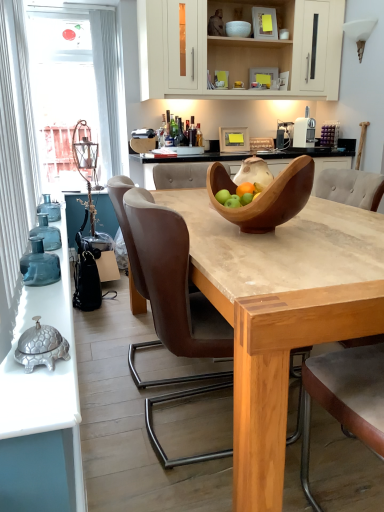
Question: Is light brown leather armchair at center at the right side of translucent glass bottles at left?

Choices:
 (A) yes
 (B) no

Answer: (A)

Question: Can you confirm if light brown leather armchair at center is taller than translucent glass bottles at left?

Choices:
 (A) yes
 (B) no

Answer: (A)

Question: Does light brown leather armchair at center lie behind translucent glass bottles at left?

Choices:
 (A) yes
 (B) no

Answer: (A)

Question: Is translucent glass bottles at left completely or partially inside light brown leather armchair at center?

Choices:
 (A) yes
 (B) no

Answer: (B)

Question: Is light brown leather armchair at center positioned with its back to translucent glass bottles at left?

Choices:
 (A) yes
 (B) no

Answer: (B)

Question: Considering the positions of brown leather chair at center and translucent glass bottles at left in the image, is brown leather chair at center taller or shorter than translucent glass bottles at left?

Choices:
 (A) short
 (B) tall

Answer: (B)

Question: Based on their positions, is brown leather chair at center located to the left or right of translucent glass bottles at left?

Choices:
 (A) right
 (B) left

Answer: (A)

Question: From the image's perspective, relative to translucent glass bottles at left, is brown leather chair at center above or below?

Choices:
 (A) above
 (B) below

Answer: (B)

Question: From a real-world perspective, is brown leather chair at center above or below translucent glass bottles at left?

Choices:
 (A) above
 (B) below

Answer: (B)

Question: Is point (46, 425) closer or farther from the camera than point (248, 28)?

Choices:
 (A) farther
 (B) closer

Answer: (B)

Question: In the image, is translucent glass bottles at left positioned in front of or behind white glossy bowl at upper center, which appears as the first bowl when viewed from the back?

Choices:
 (A) front
 (B) behind

Answer: (A)

Question: From the image's perspective, relative to white glossy bowl at upper center, the 2th bowl in the front-to-back sequence, is translucent glass bottles at left above or below?

Choices:
 (A) below
 (B) above

Answer: (A)

Question: Is translucent glass bottles at left inside the boundaries of white glossy bowl at upper center, the 2th bowl in the front-to-back sequence, or outside?

Choices:
 (A) outside
 (B) inside

Answer: (A)

Question: From the image's perspective, is wooden bowl at center, the 1th bowl positioned from the bottom, located above or below light brown leather armchair at center?

Choices:
 (A) below
 (B) above

Answer: (B)

Question: Looking at the image, does wooden bowl at center, which is the 2th bowl from back to front, seem bigger or smaller compared to light brown leather armchair at center?

Choices:
 (A) small
 (B) big

Answer: (A)